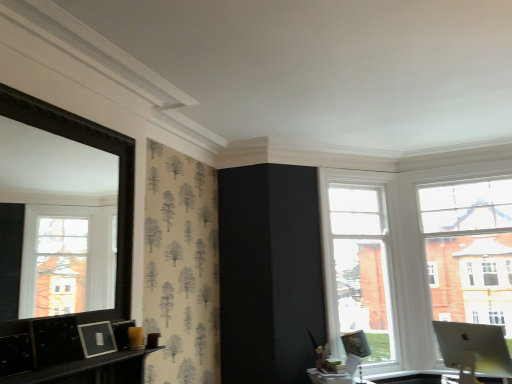
This screenshot has height=384, width=512. I want to click on clear glass window at center, which is counted as the first window, starting from the left, so click(358, 263).

Describe the element at coordinates (473, 349) in the screenshot. I see `silver metallic monitor at lower right` at that location.

The width and height of the screenshot is (512, 384). In order to click on clear glass window at center, the second window viewed from the right in this screenshot , I will do `click(358, 263)`.

Which of these two, clear glass window at center, the second window viewed from the right, or silver metallic monitor at lower right, is smaller?

silver metallic monitor at lower right.

Is clear glass window at center, which is counted as the first window, starting from the left, turned away from silver metallic monitor at lower right?

No, clear glass window at center, which is counted as the first window, starting from the left, is not facing the opposite direction of silver metallic monitor at lower right.

Is clear glass window at center, which is counted as the first window, starting from the left, next to silver metallic monitor at lower right and touching it?

clear glass window at center, which is counted as the first window, starting from the left, is not next to silver metallic monitor at lower right, and they're not touching.

Is point (334, 192) closer or farther from the camera than point (475, 337)?

Point (334, 192) is farther from the camera than point (475, 337).

Looking at this image, from a real-world perspective, which is physically below, white glass window at upper right, the 2th window in the left-to-right sequence, or clear glass window at center, the second window viewed from the right?

white glass window at upper right, the 2th window in the left-to-right sequence.

What's the angular difference between white glass window at upper right, the 2th window in the left-to-right sequence, and clear glass window at center, which is counted as the first window, starting from the left,'s facing directions?

The angle between the facing direction of white glass window at upper right, the 2th window in the left-to-right sequence, and the facing direction of clear glass window at center, which is counted as the first window, starting from the left, is 41.7 degrees.

Is white glass window at upper right, the 2th window in the left-to-right sequence, thinner than clear glass window at center, the second window viewed from the right?

Indeed, white glass window at upper right, the 2th window in the left-to-right sequence, has a lesser width compared to clear glass window at center, the second window viewed from the right.

Is clear glass window at center, which is counted as the first window, starting from the left, located within white glass window at upper right, the 2th window in the left-to-right sequence?

No, clear glass window at center, which is counted as the first window, starting from the left, is not a part of white glass window at upper right, the 2th window in the left-to-right sequence.

From the image's perspective, which one is positioned higher, silver metallic monitor at lower right or white glass window at upper right, the 2th window in the left-to-right sequence?

white glass window at upper right, the 2th window in the left-to-right sequence, is shown above in the image.

Is silver metallic monitor at lower right aimed at white glass window at upper right, the 2th window in the left-to-right sequence?

Yes.

Considering the positions of objects silver metallic monitor at lower right and white glass window at upper right, the 2th window in the left-to-right sequence, in the image provided, who is behind, silver metallic monitor at lower right or white glass window at upper right, the 2th window in the left-to-right sequence,?

Positioned behind is white glass window at upper right, the 2th window in the left-to-right sequence.

Image resolution: width=512 pixels, height=384 pixels. Identify the location of the 1st window behind the silver metallic monitor at lower right. (469, 251).

In terms of width, does silver metallic monitor at lower right look wider or thinner when compared to metallic silver swivel chair at right?

In the image, silver metallic monitor at lower right appears to be wider than metallic silver swivel chair at right.

Can you confirm if silver metallic monitor at lower right is positioned to the left of metallic silver swivel chair at right?

No.

Is silver metallic monitor at lower right looking in the opposite direction of metallic silver swivel chair at right?

No, silver metallic monitor at lower right is not facing away from metallic silver swivel chair at right.

From the image's perspective, which is above, silver metallic monitor at lower right or metallic silver swivel chair at right?

From the image's view, silver metallic monitor at lower right is above.

Would you say metallic silver swivel chair at right contains clear glass window at center, the second window viewed from the right?

Actually, clear glass window at center, the second window viewed from the right, is outside metallic silver swivel chair at right.

Considering the relative sizes of metallic silver swivel chair at right and clear glass window at center, which is counted as the first window, starting from the left, in the image provided, is metallic silver swivel chair at right thinner than clear glass window at center, which is counted as the first window, starting from the left,?

Indeed, metallic silver swivel chair at right has a lesser width compared to clear glass window at center, which is counted as the first window, starting from the left.

Which is closer to the camera, (365, 383) or (368, 260)?

Point (365, 383)

Is metallic silver swivel chair at right positioned with its back to clear glass window at center, which is counted as the first window, starting from the left?

Yes, clear glass window at center, which is counted as the first window, starting from the left, is at the back of metallic silver swivel chair at right.

Based on the photo, is metallic silver swivel chair at right at the right side of silver metallic monitor at lower right?

In fact, metallic silver swivel chair at right is to the left of silver metallic monitor at lower right.

Between metallic silver swivel chair at right and silver metallic monitor at lower right, which one has less height?

silver metallic monitor at lower right is shorter.

Locate an element on the screen. laptop above the metallic silver swivel chair at right (from a real-world perspective) is located at coordinates (473, 349).

Are metallic silver swivel chair at right and silver metallic monitor at lower right far apart?

metallic silver swivel chair at right is positioned a significant distance from silver metallic monitor at lower right.

From their relative heights in the image, would you say silver metallic monitor at lower right is taller or shorter than clear glass window at center, which is counted as the first window, starting from the left?

silver metallic monitor at lower right is shorter than clear glass window at center, which is counted as the first window, starting from the left.

Consider the image. Is silver metallic monitor at lower right looking in the opposite direction of clear glass window at center, which is counted as the first window, starting from the left?

That's not correct — silver metallic monitor at lower right is not looking away from clear glass window at center, which is counted as the first window, starting from the left.

The width and height of the screenshot is (512, 384). Identify the location of laptop that appears below the clear glass window at center, which is counted as the first window, starting from the left (from the image's perspective). (473, 349).

Considering the relative positions of silver metallic monitor at lower right and clear glass window at center, the second window viewed from the right, in the image provided, is silver metallic monitor at lower right to the left or to the right of clear glass window at center, the second window viewed from the right,?

silver metallic monitor at lower right is positioned on clear glass window at center, the second window viewed from the right,'s right side.

Find the location of a particular element. This screenshot has height=384, width=512. laptop located underneath the clear glass window at center, which is counted as the first window, starting from the left (from a real-world perspective) is located at coordinates (473, 349).

Where is `window above the white glass window at upper right, which ranks as the 1th window in right-to-left order (from a real-world perspective)`? Image resolution: width=512 pixels, height=384 pixels. window above the white glass window at upper right, which ranks as the 1th window in right-to-left order (from a real-world perspective) is located at coordinates (358, 263).

Consider the image. Based on their spatial positions, is metallic silver swivel chair at right or clear glass window at center, the second window viewed from the right, closer to silver metallic monitor at lower right?

metallic silver swivel chair at right is closer to silver metallic monitor at lower right.

Looking at the image, which one is located further to white glass window at upper right, the 2th window in the left-to-right sequence, clear glass window at center, which is counted as the first window, starting from the left, or silver metallic monitor at lower right?

Among the two, silver metallic monitor at lower right is located further to white glass window at upper right, the 2th window in the left-to-right sequence.

When comparing their distances from metallic silver swivel chair at right, does clear glass window at center, the second window viewed from the right, or white glass window at upper right, which ranks as the 1th window in right-to-left order, seem further?

white glass window at upper right, which ranks as the 1th window in right-to-left order.

Based on their spatial positions, is white glass window at upper right, which ranks as the 1th window in right-to-left order, or silver metallic monitor at lower right further from clear glass window at center, the second window viewed from the right?

The object further to clear glass window at center, the second window viewed from the right, is silver metallic monitor at lower right.

Estimate the real-world distances between objects in this image. Which object is further from white glass window at upper right, the 2th window in the left-to-right sequence, silver metallic monitor at lower right or clear glass window at center, which is counted as the first window, starting from the left?

silver metallic monitor at lower right lies further to white glass window at upper right, the 2th window in the left-to-right sequence, than the other object.

Which object lies further to the anchor point white glass window at upper right, which ranks as the 1th window in right-to-left order, clear glass window at center, which is counted as the first window, starting from the left, or metallic silver swivel chair at right?

The object further to white glass window at upper right, which ranks as the 1th window in right-to-left order, is metallic silver swivel chair at right.

Based on their spatial positions, is clear glass window at center, which is counted as the first window, starting from the left, or white glass window at upper right, which ranks as the 1th window in right-to-left order, closer to silver metallic monitor at lower right?

A: clear glass window at center, which is counted as the first window, starting from the left, lies closer to silver metallic monitor at lower right than the other object.

Considering their positions, is silver metallic monitor at lower right positioned further to metallic silver swivel chair at right than clear glass window at center, the second window viewed from the right?

silver metallic monitor at lower right lies further to metallic silver swivel chair at right than the other object.

Locate an element on the screen. The height and width of the screenshot is (384, 512). swivel chair positioned between silver metallic monitor at lower right and clear glass window at center, the second window viewed from the right, from near to far is located at coordinates (355, 351).

This screenshot has height=384, width=512. What are the coordinates of `window between metallic silver swivel chair at right and white glass window at upper right, the 2th window in the left-to-right sequence, in the horizontal direction` in the screenshot? It's located at (358, 263).

You are a GUI agent. You are given a task and a screenshot of the screen. Output one action in this format:
    pyautogui.click(x=<x>, y=<y>)
    Task: Click on the window positioned between silver metallic monitor at lower right and clear glass window at center, which is counted as the first window, starting from the left, from near to far
    The image size is (512, 384).
    Given the screenshot: What is the action you would take?
    pyautogui.click(x=469, y=251)

This screenshot has width=512, height=384. I want to click on swivel chair between silver metallic monitor at lower right and white glass window at upper right, which ranks as the 1th window in right-to-left order, in the front-back direction, so click(355, 351).